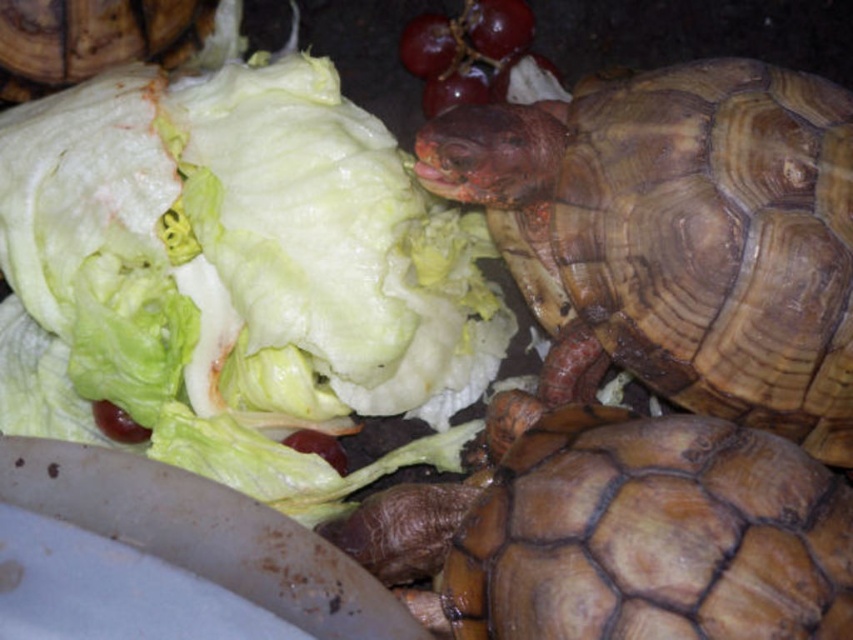
You are standing 1.2 meters away from the camera. Can you reach the point at coordinates point (653, 321) without moving closer?

The distance of point (653, 321) from the camera is 1.15 meters, so yes, you can reach the point at coordinates point (653, 321) without moving closer since you are 1.2 meters away from the camera, which is slightly farther than the point.

Looking at this image, you are a zookeeper who needs to place a new feeding tray in the enclosure. The tray must be positioned so that it is between the brown leathery tortoise at lower right and the brown matte shell at upper left. Based on their sizes, which turtle should the feeding tray be closer to?

The feeding tray should be closer to the brown matte shell at upper left because the brown leathery tortoise at lower right is wider, so the tray needs to be placed nearer to the smaller turtle to ensure enough space for both.